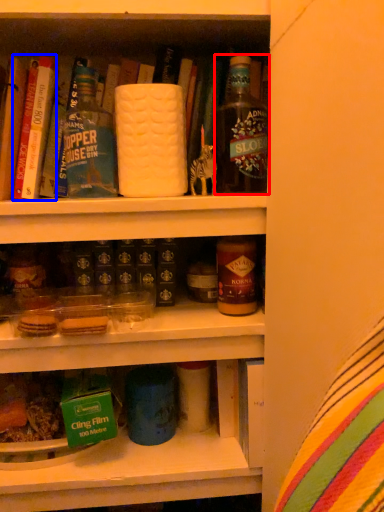
Question: Among these objects, which one is nearest to the camera, bottle (highlighted by a red box) or book (highlighted by a blue box)?

Choices:
 (A) bottle
 (B) book

Answer: (A)